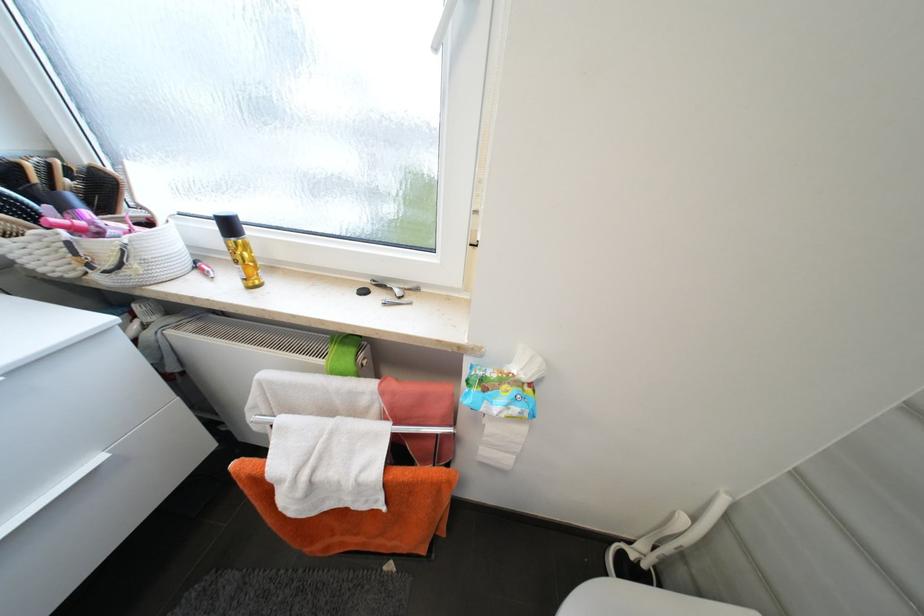
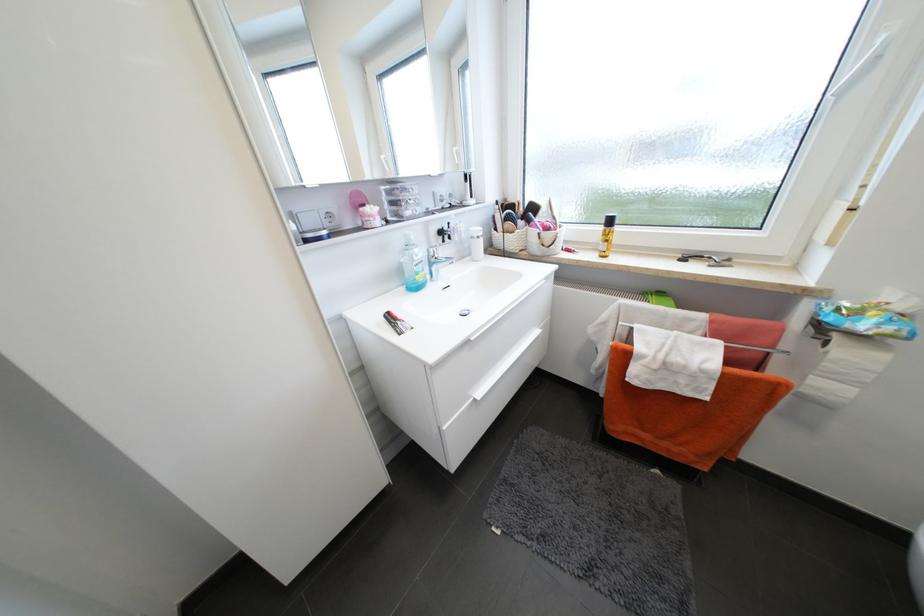
Locate, in the second image, the point that corresponds to (75,245) in the first image.

(544, 235)